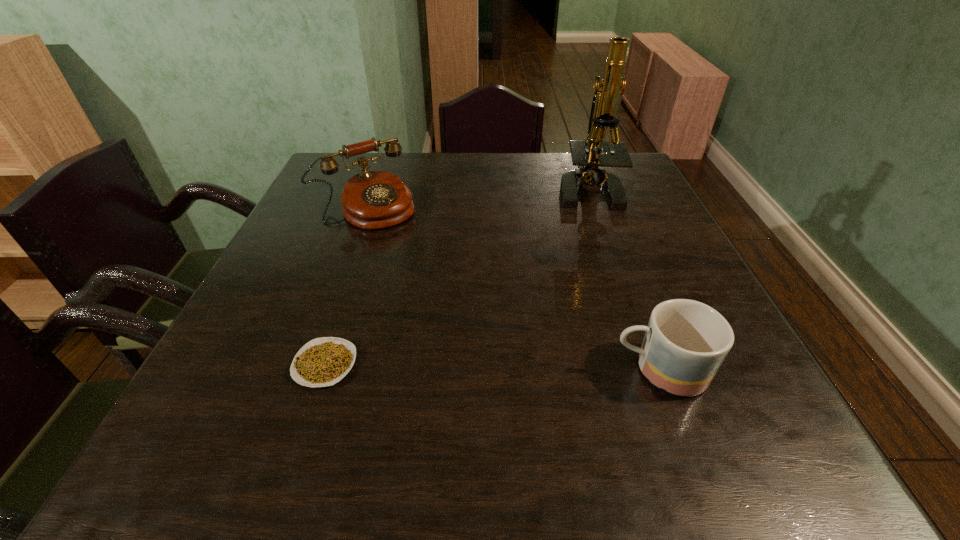
This screenshot has width=960, height=540. Find the location of `legume`. legume is located at coordinates (324, 361).

At what (x,y) coordinates should I click in order to perform the action: click on mug. Please return your answer as a coordinate pair (x, y). The height and width of the screenshot is (540, 960). Looking at the image, I should click on pos(686,341).

You are a GUI agent. You are given a task and a screenshot of the screen. Output one action in this format:
    pyautogui.click(x=<x>, y=<y>)
    Task: Click on the telephone
    
    Given the screenshot: What is the action you would take?
    pyautogui.click(x=371, y=200)

The width and height of the screenshot is (960, 540). What are the coordinates of `the tallest object` in the screenshot? It's located at (586, 154).

Identify the location of free location located on the back of the legume. Image resolution: width=960 pixels, height=540 pixels. (345, 307).

Locate an element on the screen. This screenshot has width=960, height=540. free space located on the side with the handle of the third tallest object is located at coordinates coord(564,370).

Locate an element on the screen. vacant point located on the side with the handle of the third tallest object is located at coordinates (473, 370).

Identify the location of vacant space located 0.210m on the side with the handle of the third tallest object. The height and width of the screenshot is (540, 960). (491, 370).

Find the location of `vacant region located on the dial of the second tallest object`. vacant region located on the dial of the second tallest object is located at coordinates (412, 254).

What are the coordinates of `vacant space located 0.280m on the dial of the second tallest object` in the screenshot? It's located at (444, 291).